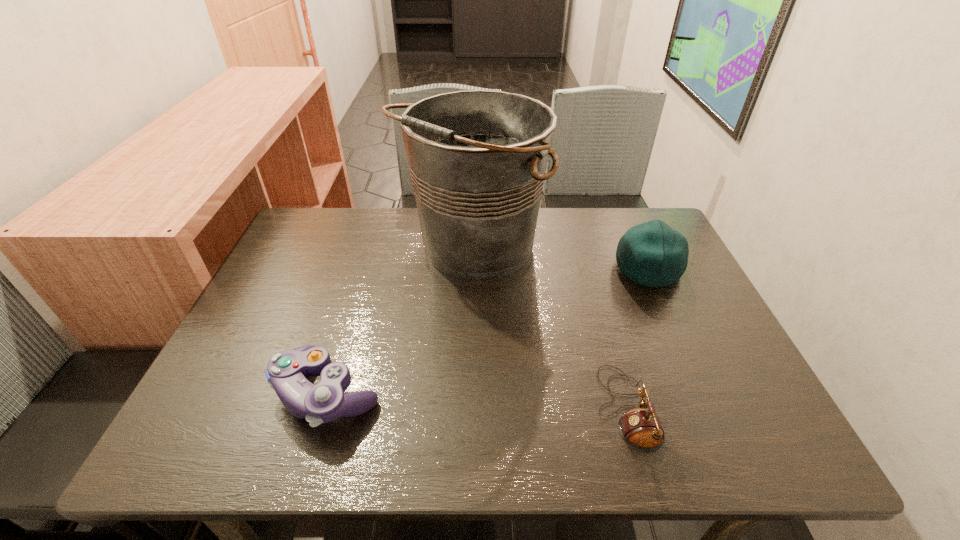
Image resolution: width=960 pixels, height=540 pixels. In order to click on free area in between the second tallest object and the bucket in this screenshot , I will do `click(560, 259)`.

Where is `unoccupied area between the tallest object and the telephone`? This screenshot has width=960, height=540. unoccupied area between the tallest object and the telephone is located at coordinates (549, 329).

The width and height of the screenshot is (960, 540). Identify the location of free space between the tallest object and the third shortest object. (560, 259).

The width and height of the screenshot is (960, 540). Find the location of `free space between the second shortest object and the bucket`. free space between the second shortest object and the bucket is located at coordinates (400, 321).

Where is `free space that is in between the rightmost object and the bucket`? This screenshot has width=960, height=540. free space that is in between the rightmost object and the bucket is located at coordinates (560, 259).

Locate an element on the screen. object that stands as the third closest to the second object from right to left is located at coordinates (286, 373).

Locate which object ranks in proximity to the tallest object. Please provide its 2D coordinates. Your answer should be formatted as a tuple, i.e. [(x, y)], where the tuple contains the x and y coordinates of a point satisfying the conditions above.

[(286, 373)]